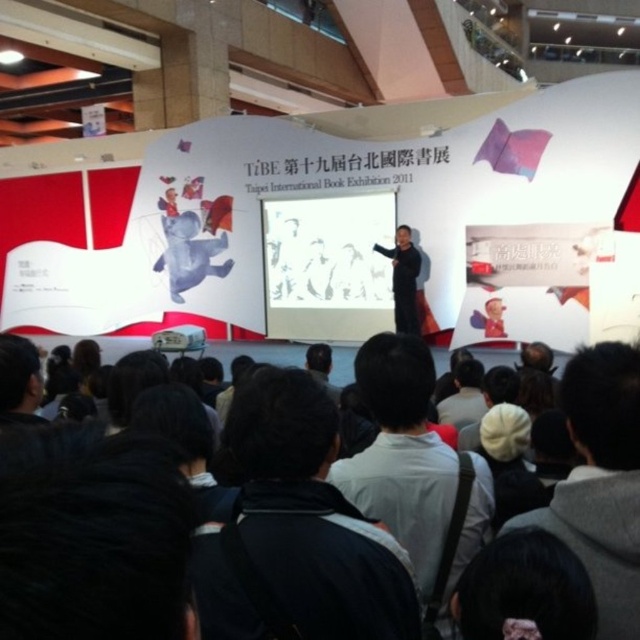
Question: Estimate the real-world distances between objects in this image. Which object is farther from the dark gray jacket at center?

Choices:
 (A) white cotton hoodie at lower right
 (B) white fabric at center

Answer: (A)

Question: Is white cotton hoodie at lower right thinner than black matte suit at center?

Choices:
 (A) yes
 (B) no

Answer: (A)

Question: Estimate the real-world distances between objects in this image. Which object is farther from the white cotton hoodie at lower right?

Choices:
 (A) dark gray jacket at center
 (B) black matte suit at center

Answer: (B)

Question: From the image, what is the correct spatial relationship of white fabric at center in relation to white cotton hoodie at lower right?

Choices:
 (A) above
 (B) below

Answer: (B)

Question: Estimate the real-world distances between objects in this image. Which object is closer to the black matte suit at center?

Choices:
 (A) white cotton hoodie at lower right
 (B) white fabric at center
 (C) dark gray jacket at center

Answer: (B)

Question: Does white fabric at center come in front of black matte suit at center?

Choices:
 (A) yes
 (B) no

Answer: (A)